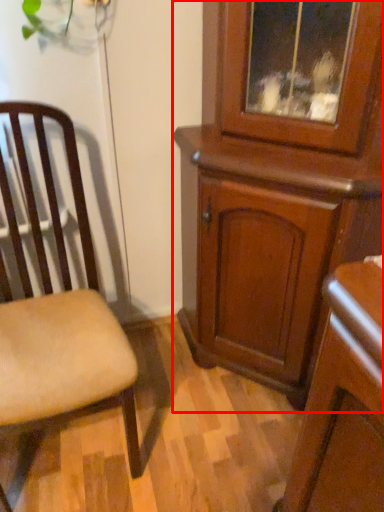
Question: From the image's perspective, where is cabinetry (annotated by the red box) located relative to chair?

Choices:
 (A) below
 (B) above

Answer: (B)